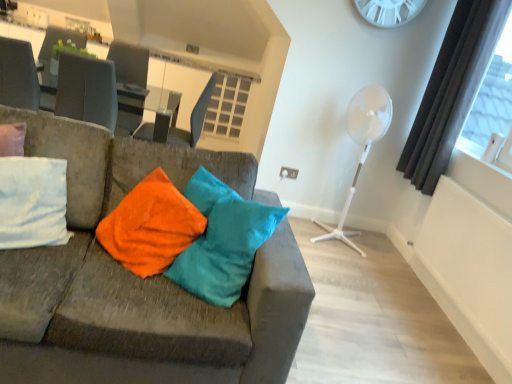
Question: Can you confirm if velvet fabric couch at left is wider than dark gray curtain at right?

Choices:
 (A) no
 (B) yes

Answer: (B)

Question: From a real-world perspective, is velvet fabric couch at left physically below dark gray curtain at right?

Choices:
 (A) no
 (B) yes

Answer: (B)

Question: Is velvet fabric couch at left positioned behind dark gray curtain at right?

Choices:
 (A) no
 (B) yes

Answer: (A)

Question: Could you tell me if velvet fabric couch at left is facing dark gray curtain at right?

Choices:
 (A) yes
 (B) no

Answer: (B)

Question: Is velvet fabric couch at left smaller than dark gray curtain at right?

Choices:
 (A) no
 (B) yes

Answer: (A)

Question: In terms of height, does white plastic clock at upper center look taller or shorter compared to white plastic fan at right?

Choices:
 (A) tall
 (B) short

Answer: (B)

Question: Considering the positions of white plastic clock at upper center and white plastic fan at right in the image, is white plastic clock at upper center bigger or smaller than white plastic fan at right?

Choices:
 (A) big
 (B) small

Answer: (B)

Question: In the image, is white plastic clock at upper center positioned in front of or behind white plastic fan at right?

Choices:
 (A) behind
 (B) front

Answer: (A)

Question: Which is correct: white plastic clock at upper center is inside white plastic fan at right, or outside of it?

Choices:
 (A) outside
 (B) inside

Answer: (A)

Question: Choose the correct answer: Is glassy white table at upper center inside matte black swivel chair at center or outside it?

Choices:
 (A) outside
 (B) inside

Answer: (A)

Question: Is glassy white table at upper center to the left or to the right of matte black swivel chair at center in the image?

Choices:
 (A) right
 (B) left

Answer: (B)

Question: Is point (9, 61) positioned closer to the camera than point (169, 132)?

Choices:
 (A) closer
 (B) farther

Answer: (A)

Question: Considering their positions, is glassy white table at upper center located in front of or behind matte black swivel chair at center?

Choices:
 (A) front
 (B) behind

Answer: (B)

Question: Is matte black swivel chair at center wider or thinner than white plastic clock at upper center?

Choices:
 (A) wide
 (B) thin

Answer: (A)

Question: Would you say matte black swivel chair at center is to the left or to the right of white plastic clock at upper center in the picture?

Choices:
 (A) right
 (B) left

Answer: (B)